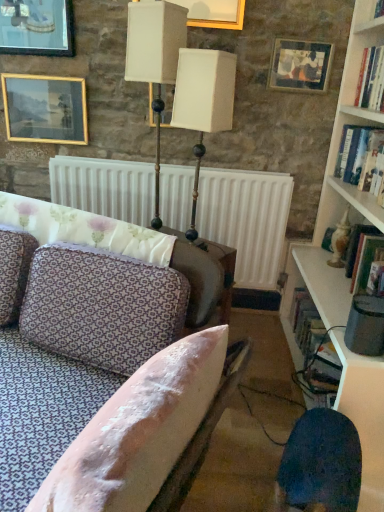
Question: Considering the relative sizes of patterned fabric couch at center and white wooden bookshelf at upper right in the image provided, is patterned fabric couch at center thinner than white wooden bookshelf at upper right?

Choices:
 (A) yes
 (B) no

Answer: (B)

Question: Is there a large distance between patterned fabric couch at center and white wooden bookshelf at upper right?

Choices:
 (A) no
 (B) yes

Answer: (B)

Question: From the image's perspective, is patterned fabric couch at center beneath white wooden bookshelf at upper right?

Choices:
 (A) no
 (B) yes

Answer: (B)

Question: Does patterned fabric couch at center appear on the right side of white wooden bookshelf at upper right?

Choices:
 (A) no
 (B) yes

Answer: (A)

Question: Is patterned fabric couch at center smaller than white wooden bookshelf at upper right?

Choices:
 (A) no
 (B) yes

Answer: (A)

Question: Would you say white wooden bookshelf at upper right is part of patterned fabric couch at center's contents?

Choices:
 (A) yes
 (B) no

Answer: (B)

Question: From the image's perspective, does cream matte table lamp at center, marked as the first table lamp in a right-to-left arrangement, appear higher than white wooden bookcase at right?

Choices:
 (A) yes
 (B) no

Answer: (A)

Question: Is the depth of cream matte table lamp at center, marked as the first table lamp in a right-to-left arrangement, less than that of white wooden bookcase at right?

Choices:
 (A) yes
 (B) no

Answer: (B)

Question: From the image's perspective, would you say cream matte table lamp at center, the 2th table lamp when ordered from left to right, is shown under white wooden bookcase at right?

Choices:
 (A) no
 (B) yes

Answer: (A)

Question: Is white wooden bookcase at right located within cream matte table lamp at center, marked as the first table lamp in a right-to-left arrangement?

Choices:
 (A) no
 (B) yes

Answer: (A)

Question: From a real-world perspective, is cream matte table lamp at center, marked as the first table lamp in a right-to-left arrangement, below white wooden bookcase at right?

Choices:
 (A) no
 (B) yes

Answer: (A)

Question: Is cream matte table lamp at center, the 2th table lamp when ordered from left to right, at the left side of white wooden bookcase at right?

Choices:
 (A) yes
 (B) no

Answer: (A)

Question: Does gold-framed picture at upper left, which appears as the second picture frame when viewed from the left, have a lesser height compared to metallic gold table lamp at upper center, placed as the 1th table lamp when sorted from left to right?

Choices:
 (A) yes
 (B) no

Answer: (A)